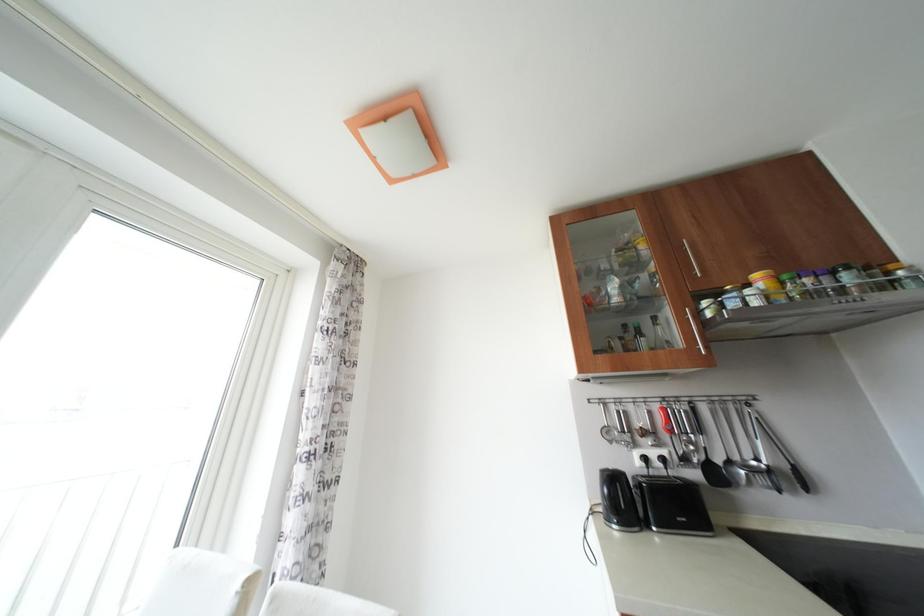
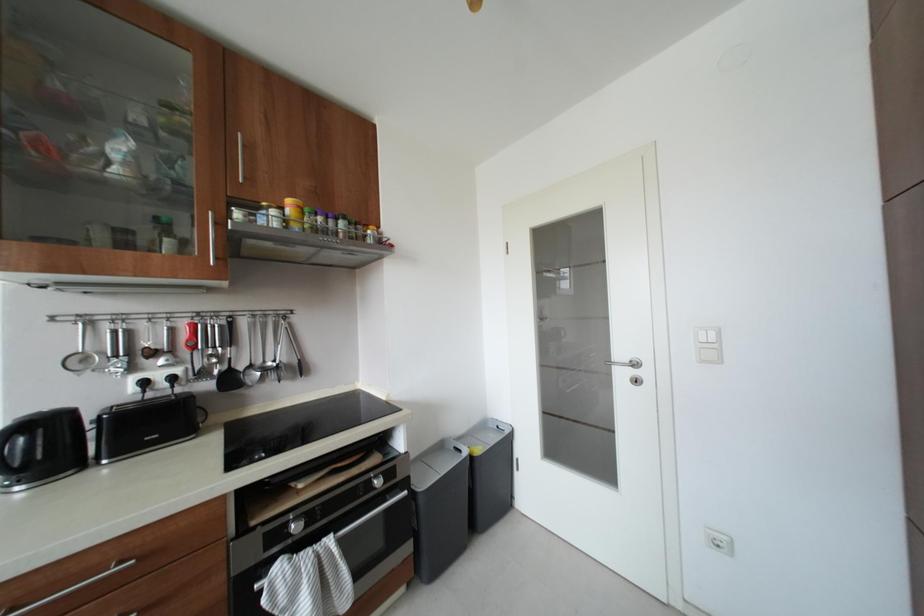
Question: How did the camera likely rotate?

Choices:
 (A) Left
 (B) Right
 (C) Up
 (D) Down

Answer: (B)